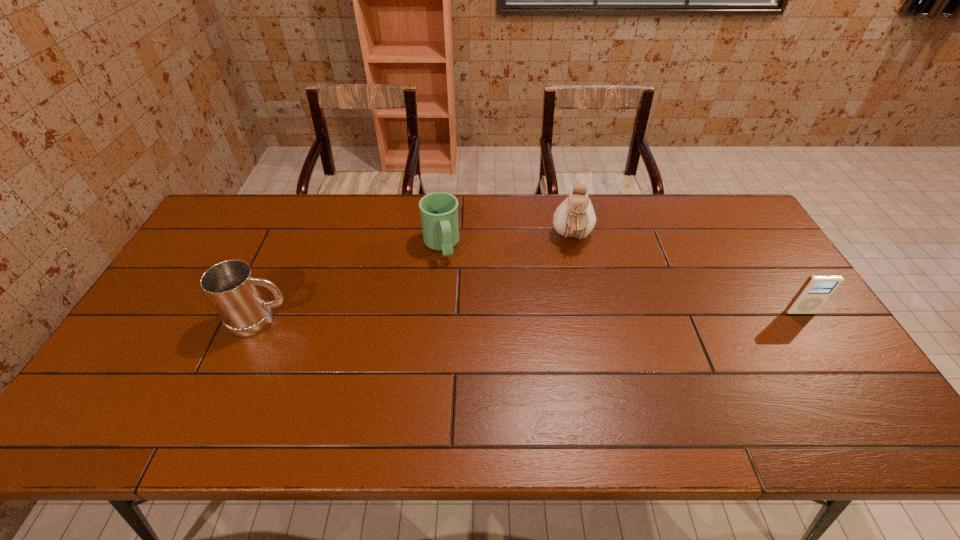
Locate an element on the screen. vacant space located 0.130m on the front-facing side of the pouch is located at coordinates (574, 284).

The image size is (960, 540). In order to click on vacant point located 0.060m on the side of the shorter mug with the handle in this screenshot , I will do `click(449, 278)`.

Locate an element on the screen. The image size is (960, 540). free space located on the side of the shorter mug with the handle is located at coordinates (463, 321).

Identify the location of vacant area located 0.380m on the side of the shorter mug with the handle. (478, 367).

Identify the location of pouch located in the far edge section of the desktop. The image size is (960, 540). (574, 218).

Where is `mug that is at the far edge`? mug that is at the far edge is located at coordinates (439, 210).

Where is `object present at the right edge`? This screenshot has width=960, height=540. object present at the right edge is located at coordinates (817, 289).

Locate an element on the screen. This screenshot has height=540, width=960. free space at the far edge of the desktop is located at coordinates (339, 204).

Where is `vacant space at the near edge of the desktop`? vacant space at the near edge of the desktop is located at coordinates coord(715,382).

Identify the location of vacant space at the right edge. This screenshot has height=540, width=960. (753, 298).